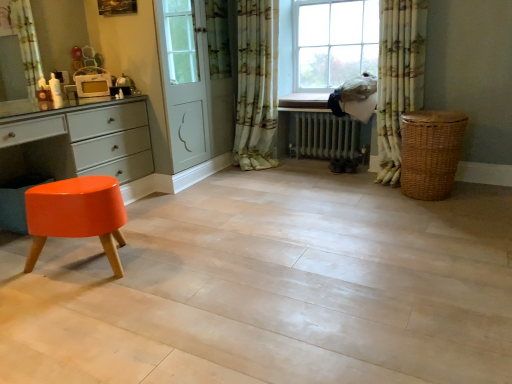
Describe the element at coordinates (76, 214) in the screenshot. The image size is (512, 384). I see `orange glossy stool at lower left` at that location.

What are the coordinates of `woven brown basket at right` in the screenshot? It's located at (430, 152).

This screenshot has width=512, height=384. What do you see at coordinates (326, 135) in the screenshot? I see `white metallic radiator at center` at bounding box center [326, 135].

This screenshot has width=512, height=384. Describe the element at coordinates (92, 82) in the screenshot. I see `white glossy microwave at upper left` at that location.

You are a GUI agent. You are given a task and a screenshot of the screen. Output one action in this format:
    pyautogui.click(x=<x>, y=<y>)
    Task: Click on the glossy orange stool at lower left
    The height and width of the screenshot is (384, 512).
    Given the screenshot: What is the action you would take?
    pyautogui.click(x=79, y=142)

How much distance is there between woven brown basket at right and glossy orange stool at lower left?

A distance of 6.68 feet exists between woven brown basket at right and glossy orange stool at lower left.

Who is taller, woven brown basket at right or glossy orange stool at lower left?

glossy orange stool at lower left.

Is point (408, 143) in front of point (109, 140)?

No.

Is the position of woven brown basket at right less distant than that of glossy orange stool at lower left?

No, it is not.

Who is more distant, floral fabric curtain at center, which is the 2th curtain from right to left, or glossy orange stool at lower left?

floral fabric curtain at center, which is the 2th curtain from right to left.

From a real-world perspective, starting from the glossy orange stool at lower left, which curtain is the 2nd one vertically above it? Please provide its 2D coordinates.

[(256, 83)]

Is floral fabric curtain at center, the 1th curtain positioned from the left, inside the boundaries of glossy orange stool at lower left, or outside?

The correct answer is: outside.

There is a white metallic radiator at center. Where is `the 1st curtain above it (from the image's perspective)`? The width and height of the screenshot is (512, 384). the 1st curtain above it (from the image's perspective) is located at coordinates (398, 77).

Is floral fabric curtain at right, acting as the second curtain starting from the left, to the left of white metallic radiator at center from the viewer's perspective?

Incorrect, floral fabric curtain at right, acting as the second curtain starting from the left, is not on the left side of white metallic radiator at center.

Is floral fabric curtain at right, which is the 1th curtain in right-to-left order, not near white metallic radiator at center?

They are positioned close to each other.

From a real-world perspective, is floral fabric curtain at right, acting as the second curtain starting from the left, positioned over white metallic radiator at center based on gravity?

Yes.

Who is shorter, white metallic radiator at center or woven brown basket at right?

white metallic radiator at center.

Where is `radiator lying above the woven brown basket at right (from the image's perspective)`? The image size is (512, 384). radiator lying above the woven brown basket at right (from the image's perspective) is located at coordinates (326, 135).

Which object is further away from the camera taking this photo, white metallic radiator at center or woven brown basket at right?

white metallic radiator at center is behind.

Does white metallic radiator at center touch woven brown basket at right?

white metallic radiator at center and woven brown basket at right are clearly separated.

Does white glossy microwave at upper left have a lesser height compared to floral fabric curtain at right, acting as the second curtain starting from the left?

Yes, white glossy microwave at upper left is shorter than floral fabric curtain at right, acting as the second curtain starting from the left.

Relative to floral fabric curtain at right, acting as the second curtain starting from the left, is white glossy microwave at upper left in front or behind?

white glossy microwave at upper left is behind floral fabric curtain at right, acting as the second curtain starting from the left.

From the image's perspective, is white glossy microwave at upper left located above or below floral fabric curtain at right, which is the 1th curtain in right-to-left order?

white glossy microwave at upper left is situated higher than floral fabric curtain at right, which is the 1th curtain in right-to-left order, in the image.

Is white glossy microwave at upper left in contact with floral fabric curtain at right, acting as the second curtain starting from the left?

No, white glossy microwave at upper left is not next to floral fabric curtain at right, acting as the second curtain starting from the left.

Can you see woven brown basket at right touching floral fabric curtain at right, which is the 1th curtain in right-to-left order?

woven brown basket at right and floral fabric curtain at right, which is the 1th curtain in right-to-left order, are not in contact.

Consider the image. From a real-world perspective, who is located higher, woven brown basket at right or floral fabric curtain at right, which is the 1th curtain in right-to-left order?

floral fabric curtain at right, which is the 1th curtain in right-to-left order, from a real-world perspective.

Based on the photo, is woven brown basket at right to the right of floral fabric curtain at right, which is the 1th curtain in right-to-left order, from the viewer's perspective?

Correct, you'll find woven brown basket at right to the right of floral fabric curtain at right, which is the 1th curtain in right-to-left order.

Would you say woven brown basket at right is outside floral fabric curtain at right, which is the 1th curtain in right-to-left order?

Absolutely, woven brown basket at right is external to floral fabric curtain at right, which is the 1th curtain in right-to-left order.

This screenshot has width=512, height=384. Find the location of `radiator below the floral fabric curtain at center, the 1th curtain positioned from the left (from a real-world perspective)`. radiator below the floral fabric curtain at center, the 1th curtain positioned from the left (from a real-world perspective) is located at coordinates (326, 135).

Is floral fabric curtain at center, which is the 2th curtain from right to left, at the back of white metallic radiator at center?

No, white metallic radiator at center is not facing away from floral fabric curtain at center, which is the 2th curtain from right to left.

Can you confirm if white metallic radiator at center is positioned to the left of floral fabric curtain at center, which is the 2th curtain from right to left?

No.

At what (x,y) coordinates should I click in order to perform the action: click on the chest of drawers below the woven brown basket at right (from the image's perspective). Please return your answer as a coordinate pair (x, y). This screenshot has height=384, width=512. Looking at the image, I should click on (79, 142).

This screenshot has height=384, width=512. I want to click on chest of drawers below the floral fabric curtain at center, which is the 2th curtain from right to left (from a real-world perspective), so click(x=79, y=142).

When comparing their distances from white glossy microwave at upper left, does floral fabric curtain at center, the 1th curtain positioned from the left, or white metallic radiator at center seem closer?

Among the two, floral fabric curtain at center, the 1th curtain positioned from the left, is located nearer to white glossy microwave at upper left.

Based on their spatial positions, is white glossy microwave at upper left or orange glossy stool at lower left closer to woven brown basket at right?

orange glossy stool at lower left is positioned closer to the anchor woven brown basket at right.

From the image, which object appears to be farther from glossy orange stool at lower left, woven brown basket at right or orange glossy stool at lower left?

Among the two, woven brown basket at right is located further to glossy orange stool at lower left.

Based on their spatial positions, is glossy orange stool at lower left or floral fabric curtain at right, which is the 1th curtain in right-to-left order, closer to floral fabric curtain at center, which is the 2th curtain from right to left?

floral fabric curtain at right, which is the 1th curtain in right-to-left order, lies closer to floral fabric curtain at center, which is the 2th curtain from right to left, than the other object.

Based on their spatial positions, is white metallic radiator at center or woven brown basket at right closer to floral fabric curtain at center, the 1th curtain positioned from the left?

Based on the image, white metallic radiator at center appears to be nearer to floral fabric curtain at center, the 1th curtain positioned from the left.

When comparing their distances from white metallic radiator at center, does woven brown basket at right or orange glossy stool at lower left seem further?

orange glossy stool at lower left lies further to white metallic radiator at center than the other object.

When comparing their distances from floral fabric curtain at right, which is the 1th curtain in right-to-left order, does white metallic radiator at center or woven brown basket at right seem further?

Among the two, white metallic radiator at center is located further to floral fabric curtain at right, which is the 1th curtain in right-to-left order.

Which object lies further to the anchor point white glossy microwave at upper left, floral fabric curtain at right, which is the 1th curtain in right-to-left order, or orange glossy stool at lower left?

floral fabric curtain at right, which is the 1th curtain in right-to-left order, lies further to white glossy microwave at upper left than the other object.

Locate an element on the screen. stool between white glossy microwave at upper left and woven brown basket at right from left to right is located at coordinates (76, 214).

Identify the location of stool located between glossy orange stool at lower left and white metallic radiator at center in the left-right direction. Image resolution: width=512 pixels, height=384 pixels. (76, 214).

In order to click on radiator situated between white glossy microwave at upper left and floral fabric curtain at right, which is the 1th curtain in right-to-left order, from left to right in this screenshot , I will do `click(326, 135)`.

Locate an element on the screen. the chest of drawers positioned between orange glossy stool at lower left and floral fabric curtain at center, which is the 2th curtain from right to left, from near to far is located at coordinates (79, 142).